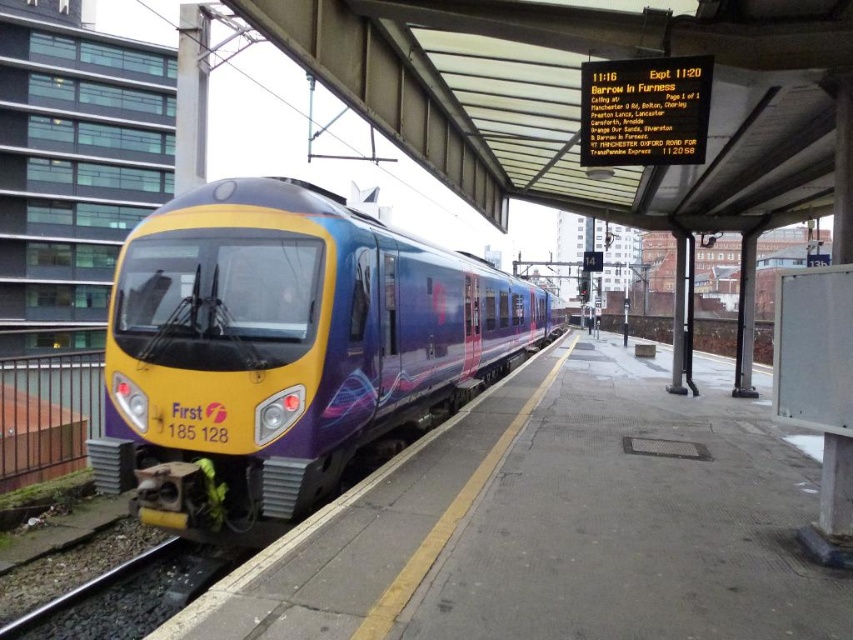
You are a passenger waiting on the concrete platform at center. You need to cross to the black gravel train track at lower left. Is the platform large enough for you to safely move to the track without stepping off the platform?

The concrete platform at center is larger in size than the black gravel train track at lower left, so yes, the platform is large enough for you to move to the track safely without needing to step off.

You are standing on the train platform and notice two points marked on the ground. The first point is at coordinate point [363,545] and the second is at point [258,292]. If you face the direction the train is heading, which point is closer to the front of the train?

Point [363,545] is in front of point [258,292], so it is closer to the front of the train when facing the direction the train is heading.

Looking at this image, you are a maintenance worker on the concrete platform at center. You need to reach the black gravel train track at lower left. Is the track below or above your current position?

The concrete platform at center is taller than the black gravel train track at lower left, so the track is below your current position.